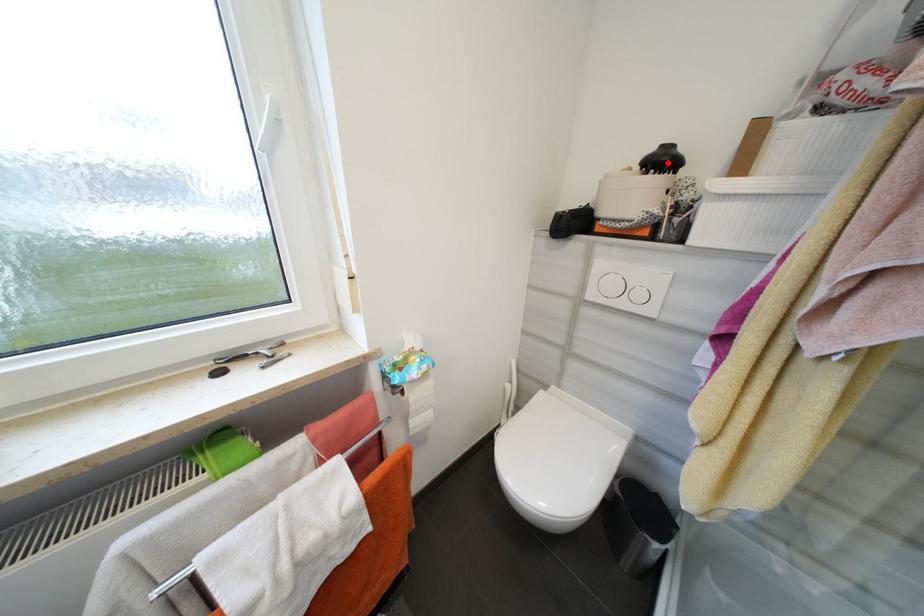
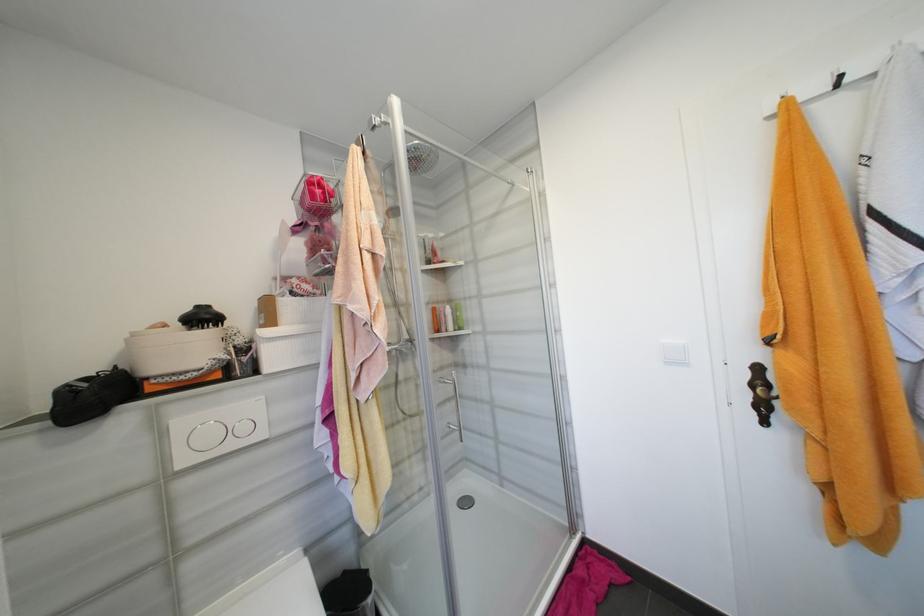
Question: I am providing you with two images of the same scene from different viewpoints. A red point is marked on the first image. Is the red point's position out of view in image 2?

Choices:
 (A) Yes
 (B) No

Answer: (B)